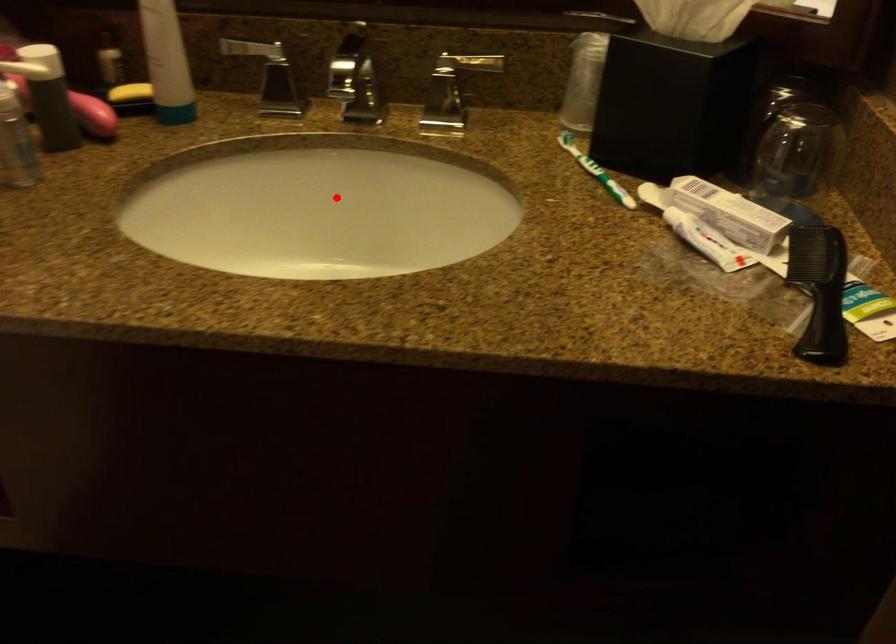
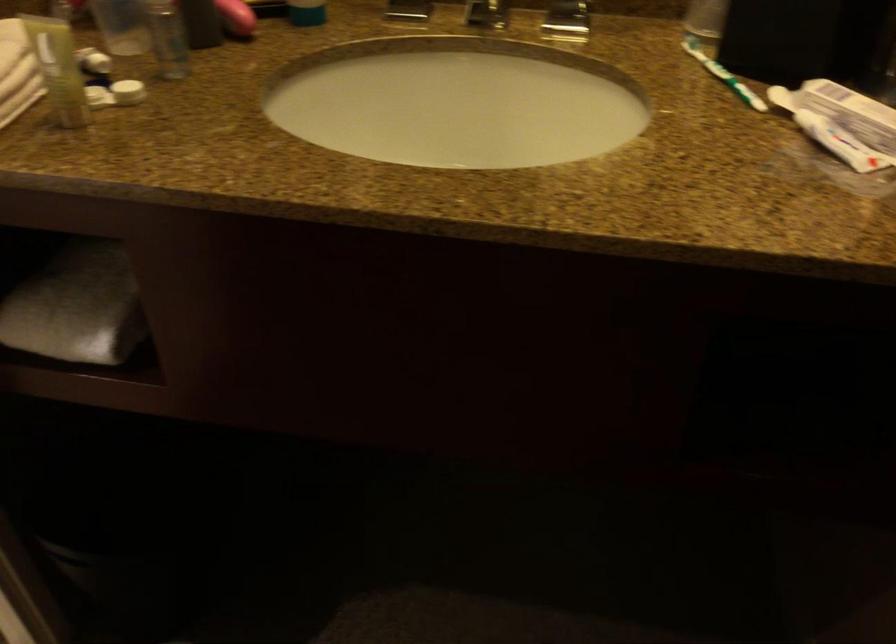
The point at the highlighted location is marked in the first image. Where is the corresponding point in the second image?

(457, 102)